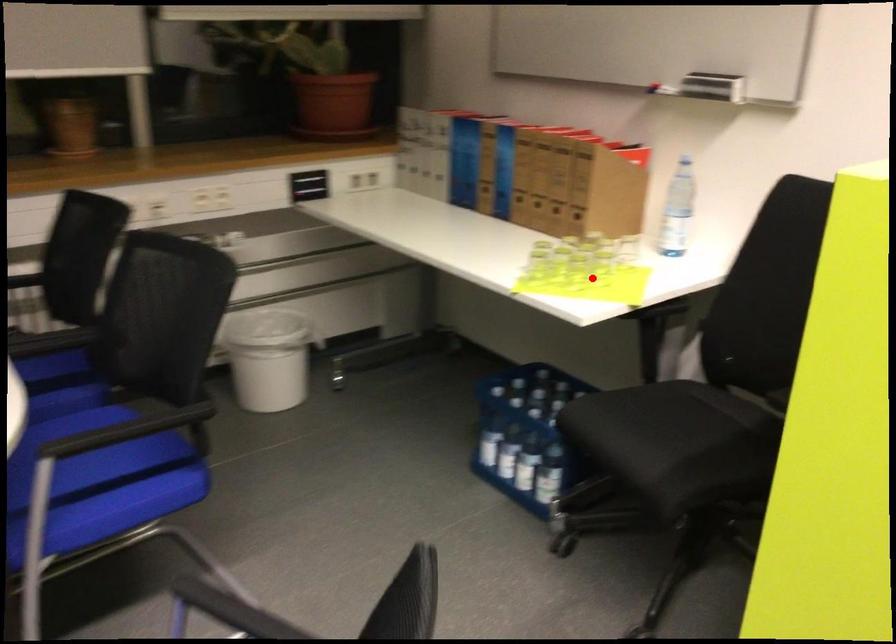
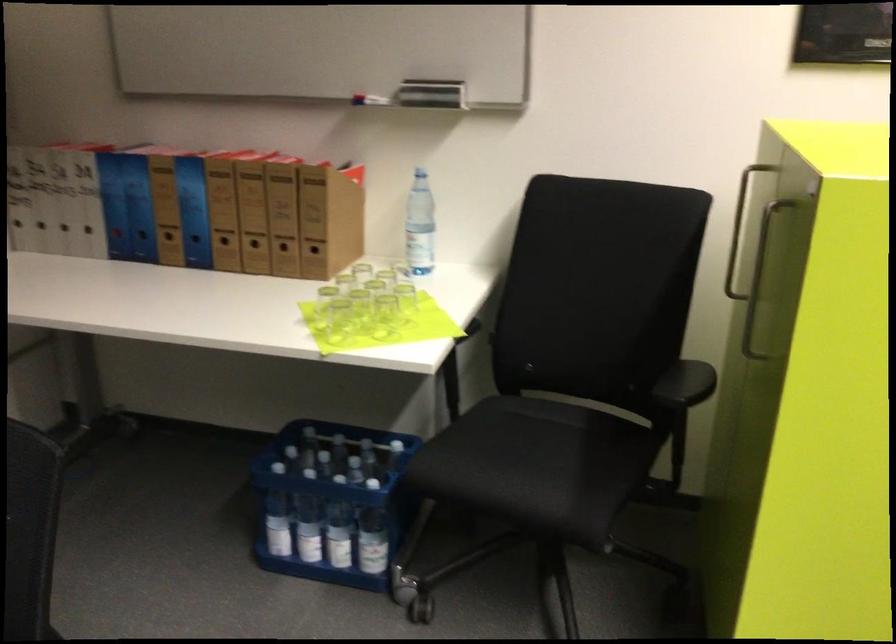
Question: I am providing you with two images of the same scene from different viewpoints. A red point is marked on the first image. Is the red point's position out of view in image 2?

Choices:
 (A) Yes
 (B) No

Answer: (B)